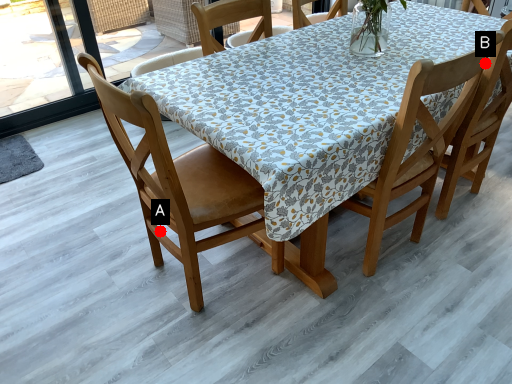
Question: Two points are circled on the image, labeled by A and B beside each circle. Which point is closer to the camera taking this photo?

Choices:
 (A) A is closer
 (B) B is closer

Answer: (B)